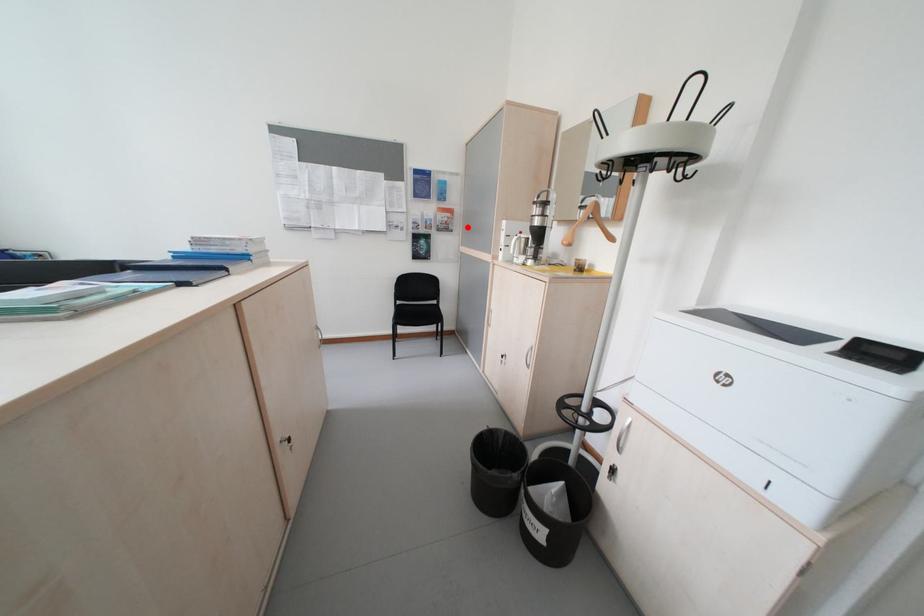
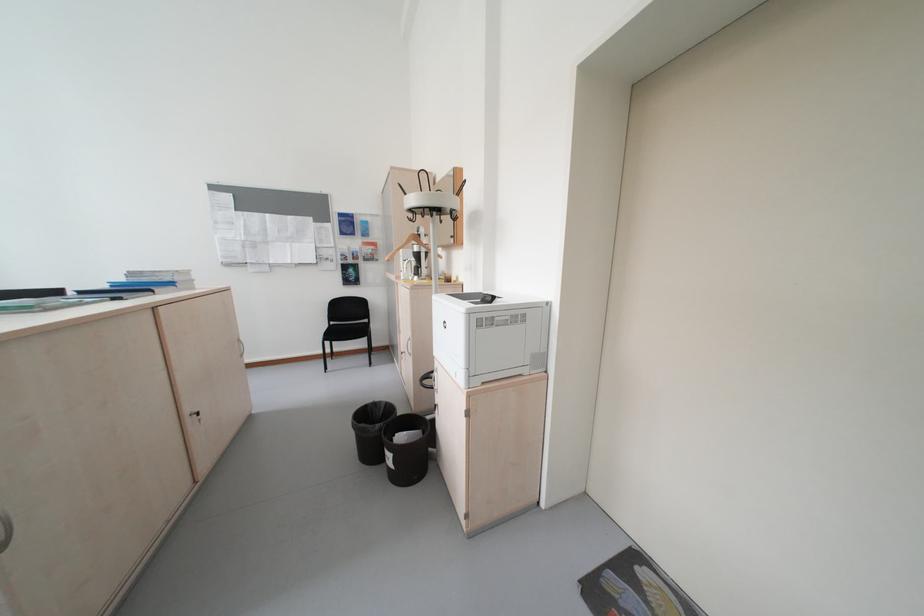
Where in the second image is the point corresponding to the highlighted location from the first image?

(393, 257)